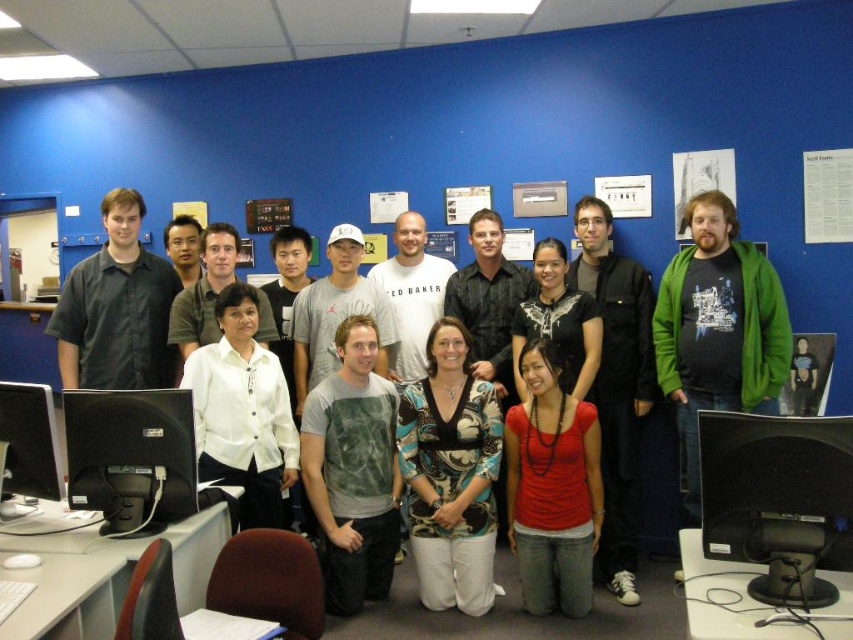
You are standing in an office with a blue wall in the background. You need to locate the black glossy monitor at lower left. Based on the coordinates provided, where exactly should you look to find it?

The black glossy monitor at lower left is located at point (131, 458).

You are standing in the office scene and want to place a small plant between the two points, point [192,397] and point [115,275]. Which point should the plant be closer to in order to be nearer to the viewer?

The plant should be placed closer to point [192,397] because it is closer to the viewer than point [115,275].

You are a photographer setting up for a group photo in an office. You notice the black glossy monitor at lower right and the matte black shirt at left. If you want to ensure both are in focus, what should you consider about their distance?

The black glossy monitor at lower right is 2.48 meters away from the matte black shirt at left. To ensure both are in focus, the photographer should use a small aperture setting to increase the depth of field, allowing both objects at different distances to be sharp.